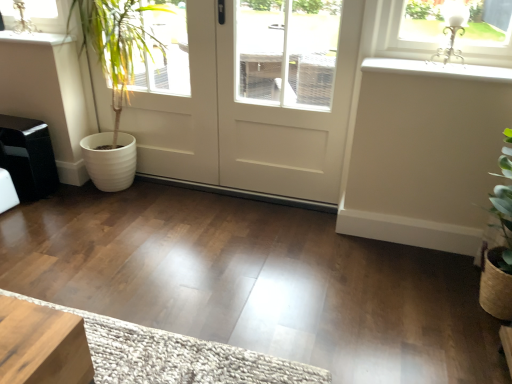
You are a GUI agent. You are given a task and a screenshot of the screen. Output one action in this format:
    pyautogui.click(x=<x>, y=<y>)
    Task: Click on the spots to the right of white textured doormat at lower center
    This screenshot has width=512, height=384.
    Given the screenshot: What is the action you would take?
    pyautogui.click(x=332, y=312)